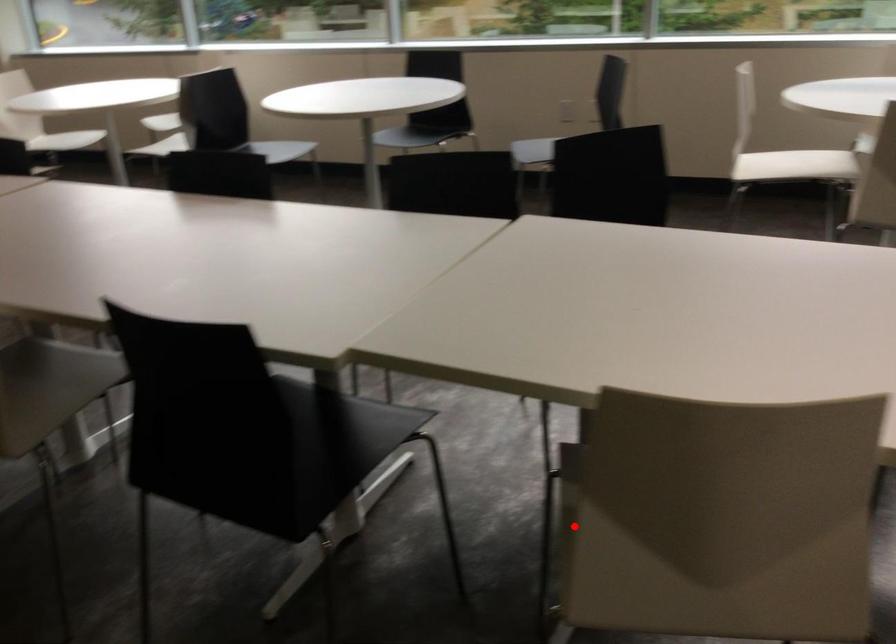
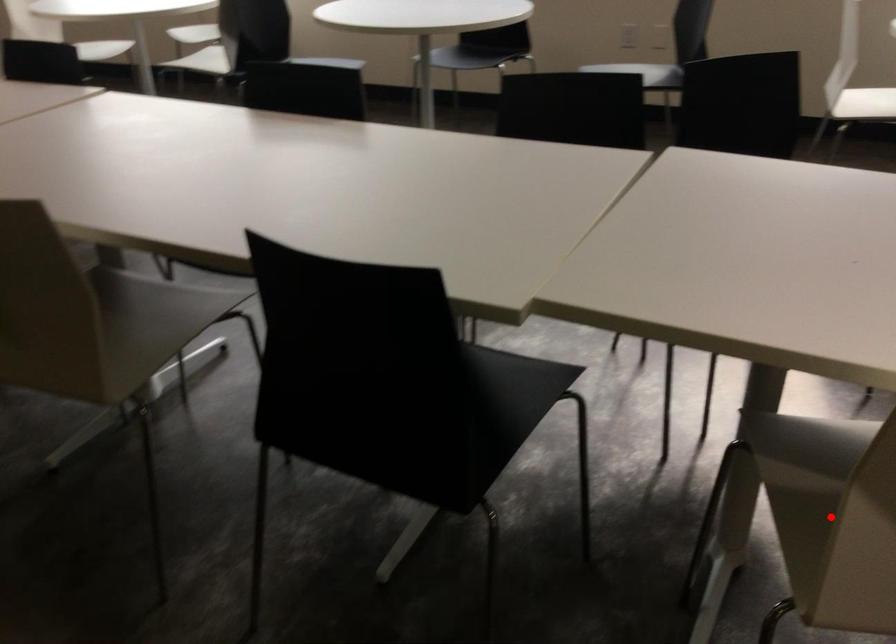
I am providing you with two images of the same scene from different viewpoints. A red point is marked on the first image and another point is marked on the second image. Do the highlighted points in image1 and image2 indicate the same real-world spot?

Yes